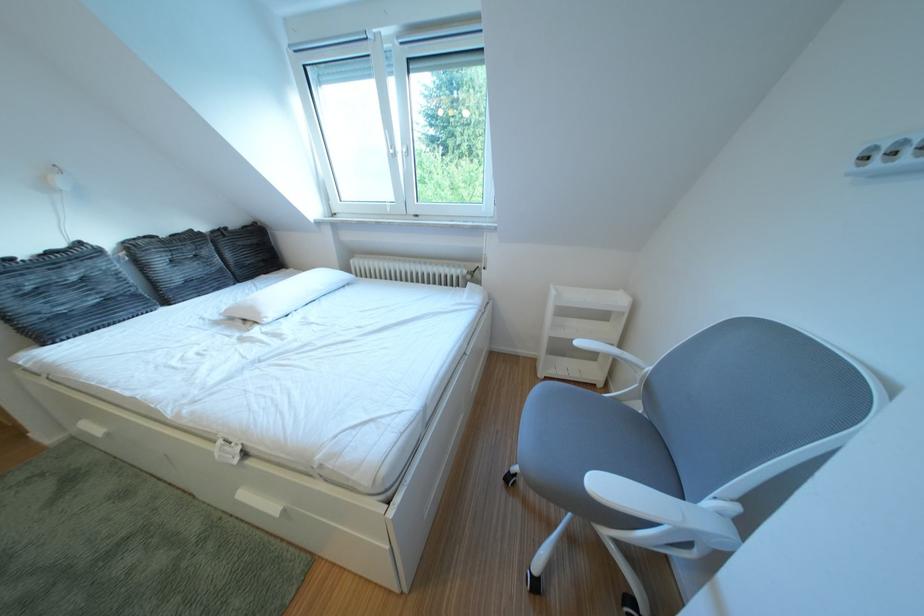
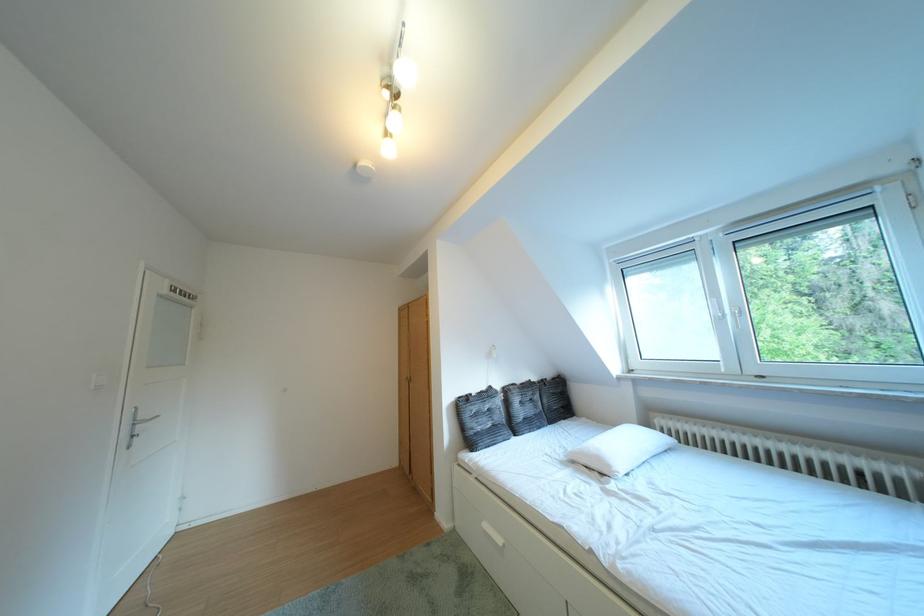
Find the pixel in the second image that matches (407,151) in the first image.

(736, 315)